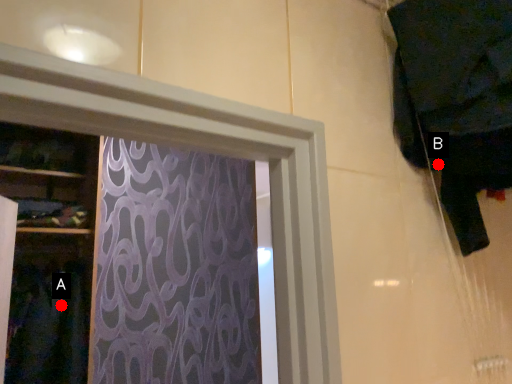
Question: Two points are circled on the image, labeled by A and B beside each circle. Which of the following is the farthest from the observer?

Choices:
 (A) A is further
 (B) B is further

Answer: (A)